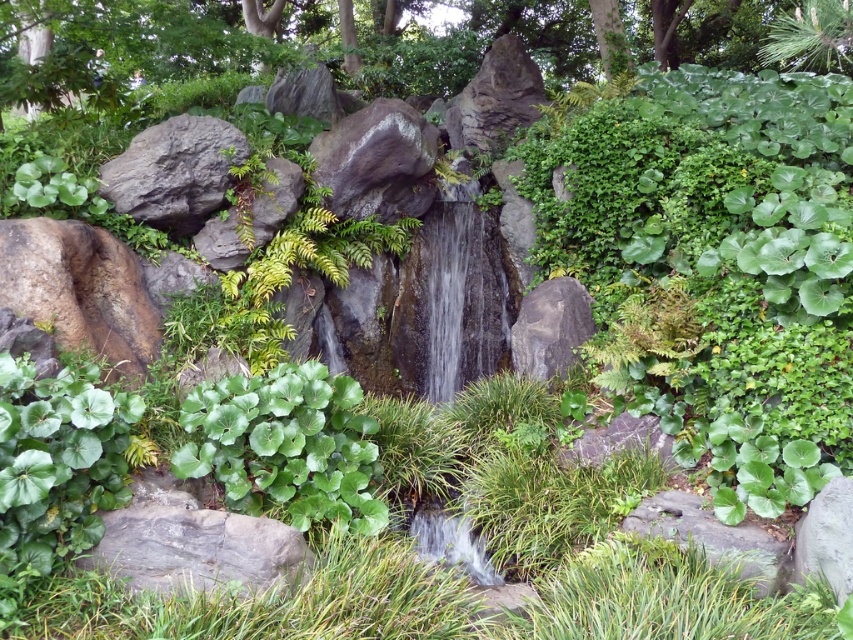
Is green matte leaf at center to the right of gray rough rock at lower right from the viewer's perspective?

No, green matte leaf at center is not to the right of gray rough rock at lower right.

Between point (292, 445) and point (808, 560), which one is positioned behind?

The point (292, 445) is behind.

The image size is (853, 640). What do you see at coordinates (286, 445) in the screenshot? I see `green matte leaf at center` at bounding box center [286, 445].

You are a GUI agent. You are given a task and a screenshot of the screen. Output one action in this format:
    pyautogui.click(x=<x>, y=<y>)
    Task: Click on the green matte leaf at center
    
    Given the screenshot: What is the action you would take?
    pyautogui.click(x=286, y=445)

Between point (190, 172) and point (851, 554), which one is positioned in front?

Positioned in front is point (851, 554).

Which is below, gray rough boulder at upper left or gray rough rock at lower right?

Positioned lower is gray rough rock at lower right.

Does point (170, 195) lie in front of point (828, 570)?

No, it is behind (828, 570).

The height and width of the screenshot is (640, 853). Identify the location of gray rough boulder at upper left. (173, 172).

Is green matte leaf at center to the right of brown rough rock at lower left from the viewer's perspective?

Correct, you'll find green matte leaf at center to the right of brown rough rock at lower left.

Which is more to the left, green matte leaf at center or brown rough rock at lower left?

brown rough rock at lower left

At what (x,y) coordinates should I click in order to perform the action: click on green matte leaf at center. Please return your answer as a coordinate pair (x, y). The image size is (853, 640). Looking at the image, I should click on (286, 445).